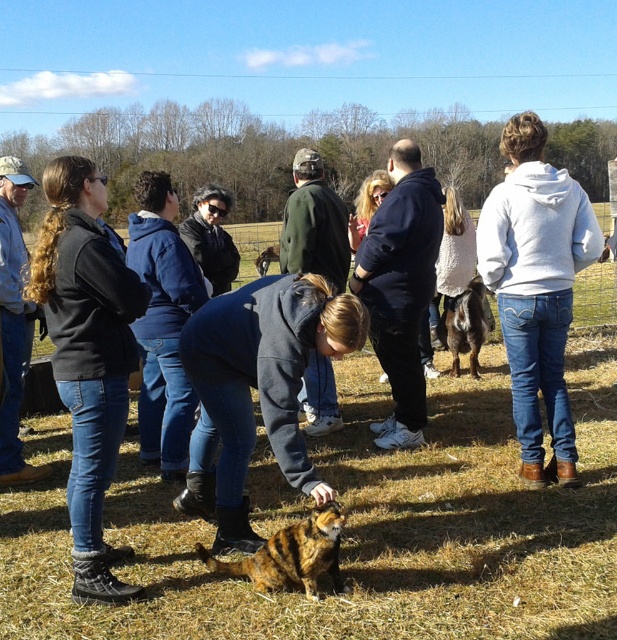
Measure the distance from dark blue hoodie at center to striped fur cat at center.

2.05 meters

Is point (0, 285) positioned behind point (318, 566)?

Yes, it is.

Locate an element on the screen. This screenshot has width=617, height=640. dark blue hoodie at center is located at coordinates (14, 321).

Does dark blue hoodie at center appear over brown fur cat at center?

No, dark blue hoodie at center is not above brown fur cat at center.

Between point (12, 368) and point (278, 259), which one is positioned in front?

Point (12, 368) is in front.

Where is `dark blue hoodie at center`? Image resolution: width=617 pixels, height=640 pixels. dark blue hoodie at center is located at coordinates (14, 321).

Between white sweater at center and brown fur cat at center, which one is positioned higher?

brown fur cat at center is higher up.

Can you confirm if white sweater at center is thinner than brown fur cat at center?

Incorrect, white sweater at center's width is not less than brown fur cat at center's.

Which is in front, point (453, 243) or point (257, 259)?

Point (453, 243) is in front.

I want to click on white sweater at center, so click(452, 262).